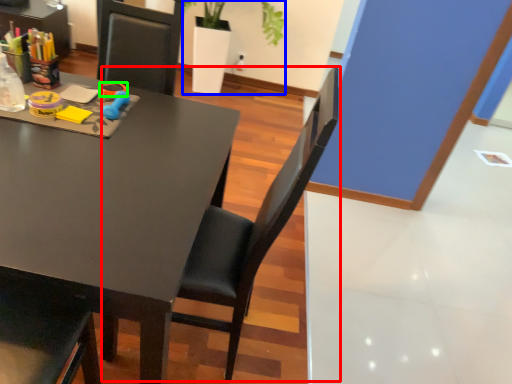
Question: Based on their relative distances, which object is farther from chair (highlighted by a red box)? Choose from houseplant (highlighted by a blue box) and scissors (highlighted by a green box).

Choices:
 (A) houseplant
 (B) scissors

Answer: (A)